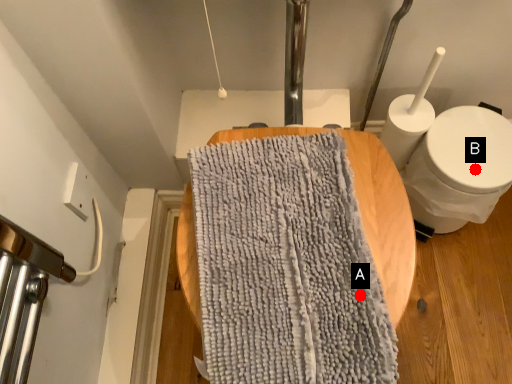
Question: Two points are circled on the image, labeled by A and B beside each circle. Which point appears farthest from the camera in this image?

Choices:
 (A) A is further
 (B) B is further

Answer: (B)